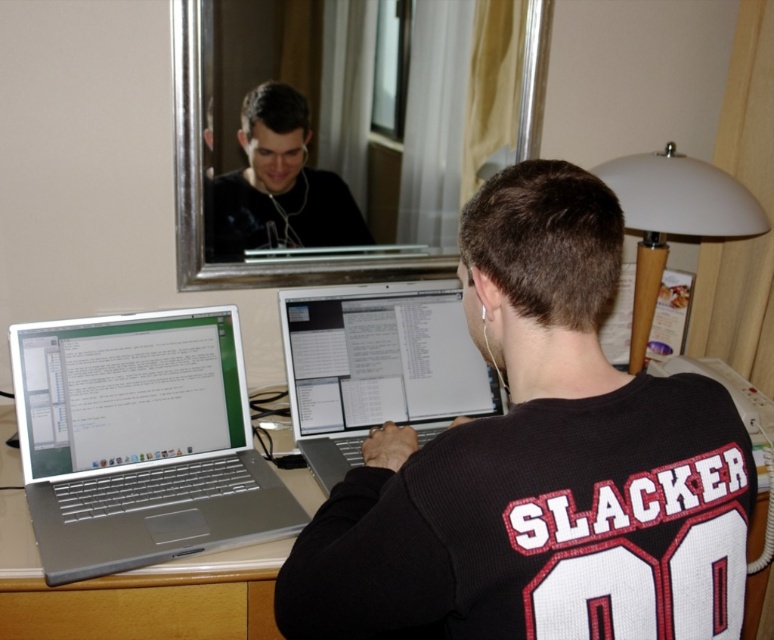
Does point (749, 234) come farther from viewer compared to point (235, 634)?

Yes, it is behind point (235, 634).

Which is in front, point (738, 220) or point (28, 609)?

Positioned in front is point (28, 609).

Which is behind, point (670, 227) or point (29, 618)?

Point (670, 227)

Find the location of `white plastic lampshade at upper right`. white plastic lampshade at upper right is located at coordinates (673, 218).

Who is positioned more to the left, silver metallic laptop at left or silver/metallic mirror at upper center?

silver metallic laptop at left is more to the left.

Can you confirm if silver metallic laptop at left is positioned to the right of silver/metallic mirror at upper center?

In fact, silver metallic laptop at left is to the left of silver/metallic mirror at upper center.

What are the coordinates of `silver metallic laptop at left` in the screenshot? It's located at (139, 442).

Is matte black shirt at upper center smaller than white plastic lampshade at upper right?

Indeed, matte black shirt at upper center has a smaller size compared to white plastic lampshade at upper right.

The height and width of the screenshot is (640, 774). Identify the location of matte black shirt at upper center. (279, 184).

Is point (312, 196) positioned before point (646, 220)?

No.

Find the location of a particular element. This screenshot has height=640, width=774. matte black shirt at upper center is located at coordinates (279, 184).